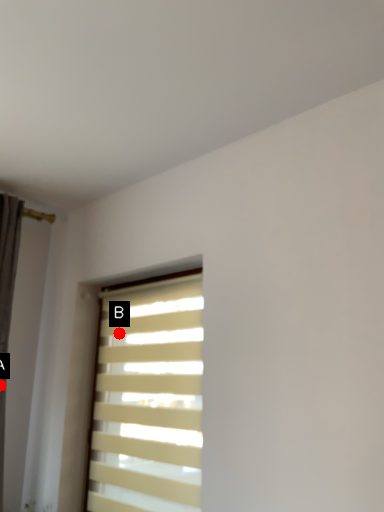
Question: Two points are circled on the image, labeled by A and B beside each circle. Which point is closer to the camera?

Choices:
 (A) A is closer
 (B) B is closer

Answer: (A)